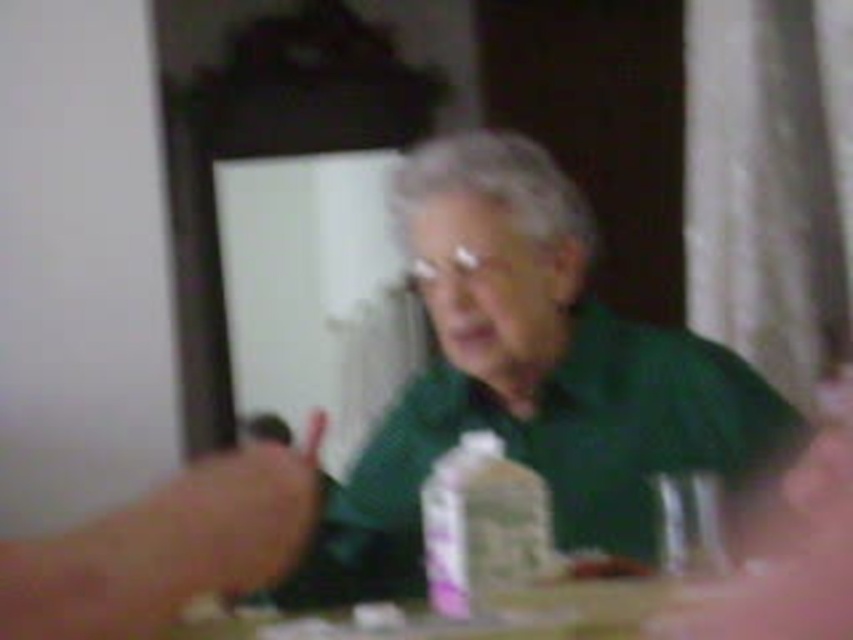
You are a healthcare assistant checking on a patient in their home. You notice the green matte shirt at center and the wooden table at center. Which object is wider?

The green matte shirt at center is wider than the wooden table at center.

You are a caregiver entering the room and need to place a medical kit on the wooden table at center. However, the green matte shirt at center is in the way. Can you move the shirt to access the table?

The wooden table at center is behind the green matte shirt at center, so you can move the green matte shirt at center to access the wooden table at center.